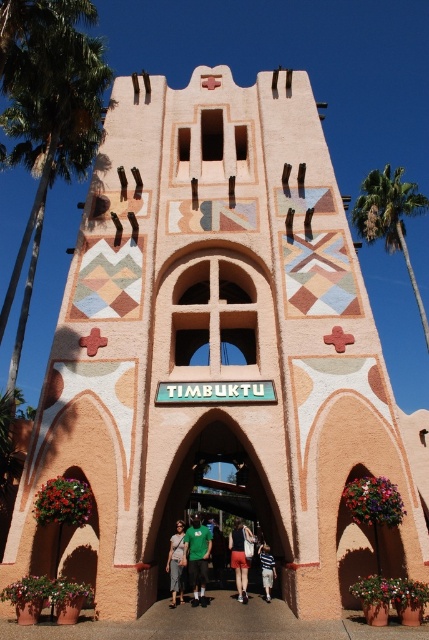
You are standing in front of the TIMBUKTU tower and notice a green leafy palm tree at upper right and a green fabric shirt at center. Which object appears higher in the image?

The green leafy palm tree at upper right is positioned over the green fabric shirt at center, so it appears higher in the image.